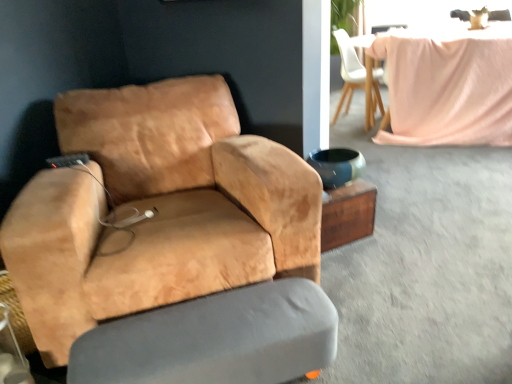
Identify the location of vacant area in front of wooden side table at center. This screenshot has width=512, height=384. (364, 271).